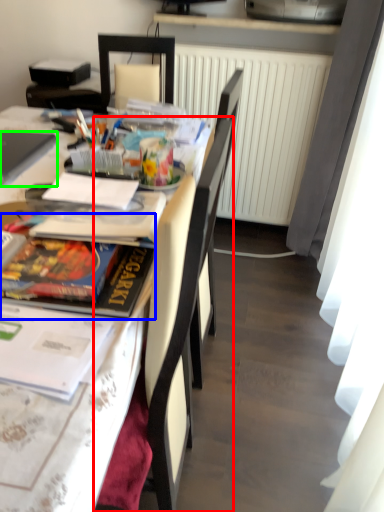
Question: Which is farther away from chair (highlighted by a red box)? magazine (highlighted by a blue box) or laptop (highlighted by a green box)?

Choices:
 (A) magazine
 (B) laptop

Answer: (B)